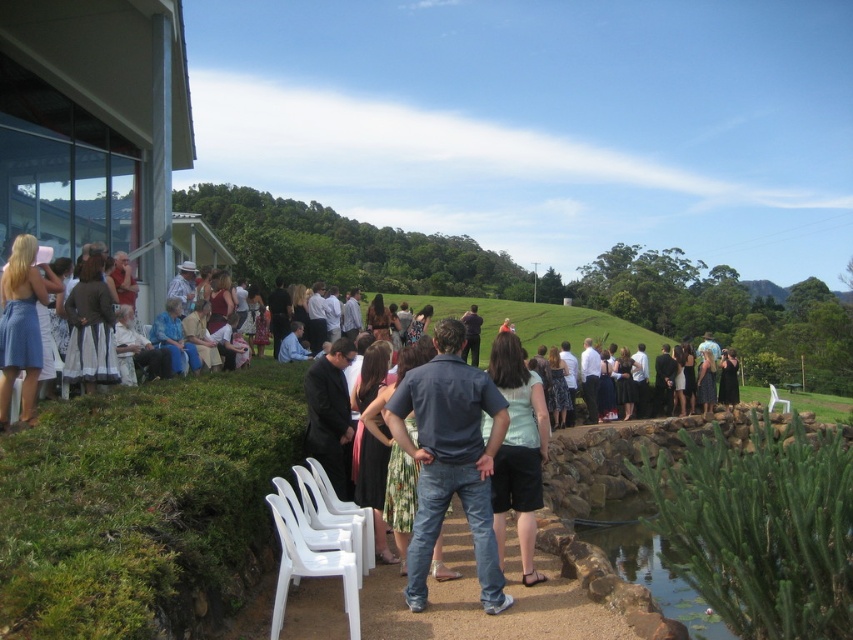
Looking at this image, measure the distance between point (619, 513) and camera.

Point (619, 513) is 50.38 feet from camera.

Is green mossy pond at lower right smaller than white plastic chairs at lower left?

No, green mossy pond at lower right is not smaller than white plastic chairs at lower left.

At what (x,y) coordinates should I click in order to perform the action: click on green mossy pond at lower right. Please return your answer as a coordinate pair (x, y). The image size is (853, 640). Looking at the image, I should click on (647, 561).

Where is `white plastic chairs at lower center`? This screenshot has width=853, height=640. white plastic chairs at lower center is located at coordinates point(334,509).

Which is behind, point (369, 518) or point (769, 396)?

The point (769, 396) is more distant.

Between point (321, 483) and point (786, 404), which one is positioned behind?

The point (786, 404) is behind.

Where is `white plastic chairs at lower center`? The width and height of the screenshot is (853, 640). white plastic chairs at lower center is located at coordinates (334, 509).

Who is positioned more to the left, light blue fabric dress at center or white plastic chair at lower right?

light blue fabric dress at center

Is light blue fabric dress at center bigger than white plastic chair at lower right?

Incorrect, light blue fabric dress at center is not larger than white plastic chair at lower right.

Locate an element on the screen. Image resolution: width=853 pixels, height=640 pixels. light blue fabric dress at center is located at coordinates (518, 449).

Locate an element on the screen. light blue fabric dress at center is located at coordinates (518, 449).